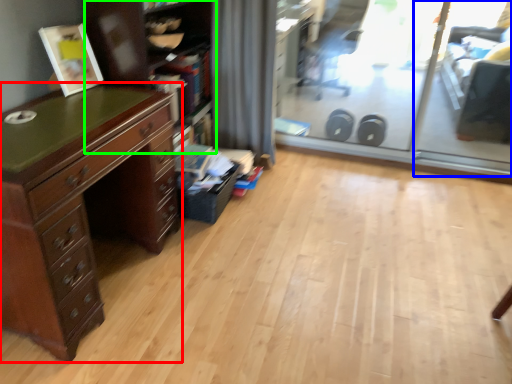
Question: Based on their relative distances, which object is farther from chest of drawers (highlighted by a red box)? Choose from screen door (highlighted by a blue box) and bookshelf (highlighted by a green box).

Choices:
 (A) screen door
 (B) bookshelf

Answer: (A)